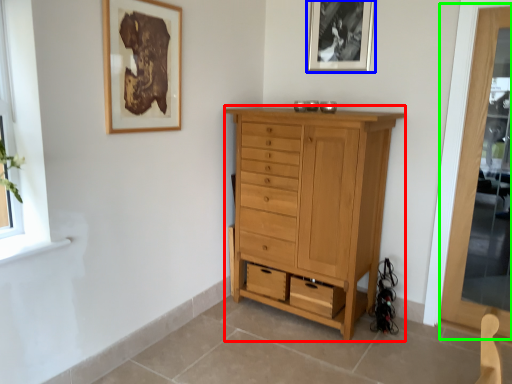
Question: Which object is the closest to the chest of drawers (highlighted by a red box)? Choose among these: picture frame (highlighted by a blue box) or screen door (highlighted by a green box).

Choices:
 (A) picture frame
 (B) screen door

Answer: (B)